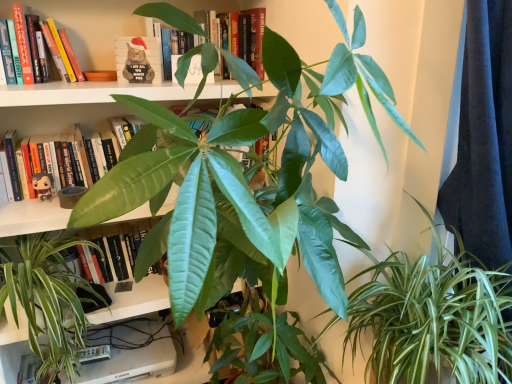
Find the location of `green glossy leafy plant at lower right, the 1th houseplant when ordered from right to left`. green glossy leafy plant at lower right, the 1th houseplant when ordered from right to left is located at coordinates (433, 318).

How much space does green glossy leafy plant at lower right, the 1th houseplant when ordered from right to left, occupy vertically?

The height of green glossy leafy plant at lower right, the 1th houseplant when ordered from right to left, is 20.48 inches.

The width and height of the screenshot is (512, 384). What are the coordinates of `green glossy leafy plant at center, which is counted as the 1th houseplant, starting from the left` in the screenshot? It's located at (47, 300).

Measure the distance between matte black figurine at left, arranged as the first book when ordered from the bottom, and camera.

matte black figurine at left, arranged as the first book when ordered from the bottom, is 1.38 meters from camera.

I want to click on matte black figurine at left, the third book when ordered from top to bottom, so click(34, 126).

What do you see at coordinates (78, 45) in the screenshot? This screenshot has height=384, width=512. I see `hardcover book at upper left, arranged as the 2th book when viewed from the top` at bounding box center [78, 45].

Describe the element at coordinates (172, 17) in the screenshot. This screenshot has width=512, height=384. I see `hardcover book at upper center, which appears as the third book when ordered from the bottom` at that location.

What is the approximate width of green matte leaf at upper center?

It is 2.64 inches.

Image resolution: width=512 pixels, height=384 pixels. I want to click on green glossy leafy plant at center, the second houseplant when ordered from right to left, so click(244, 178).

Locate an element on the screen. This screenshot has width=512, height=384. green glossy leafy plant at lower right, arranged as the 3th houseplant when viewed from the left is located at coordinates (433, 318).

Is green glossy leafy plant at center, the second houseplant in the left-to-right sequence, turned away from santa hat plush at upper center?

green glossy leafy plant at center, the second houseplant in the left-to-right sequence, is not turned away from santa hat plush at upper center.

Would you say green glossy leafy plant at center, the second houseplant in the left-to-right sequence, is inside or outside santa hat plush at upper center?

green glossy leafy plant at center, the second houseplant in the left-to-right sequence, lies outside santa hat plush at upper center.

How far apart are green glossy leafy plant at center, the second houseplant when ordered from right to left, and santa hat plush at upper center?

The distance of green glossy leafy plant at center, the second houseplant when ordered from right to left, from santa hat plush at upper center is 30.81 inches.

Does green glossy leafy plant at center, the second houseplant in the left-to-right sequence, touch santa hat plush at upper center?

No, green glossy leafy plant at center, the second houseplant in the left-to-right sequence, is not touching santa hat plush at upper center.

How different are the orientations of green glossy leafy plant at center, the second houseplant when ordered from right to left, and green glossy leafy plant at lower right, arranged as the 3th houseplant when viewed from the left, in degrees?

There is a 6.05-degree angle between the facing directions of green glossy leafy plant at center, the second houseplant when ordered from right to left, and green glossy leafy plant at lower right, arranged as the 3th houseplant when viewed from the left.

Does green glossy leafy plant at center, the second houseplant when ordered from right to left, have a larger size compared to green glossy leafy plant at lower right, the 1th houseplant when ordered from right to left?

Yes.

In order to click on the 1st houseplant below the green glossy leafy plant at center, the second houseplant in the left-to-right sequence (from a real-world perspective) in this screenshot , I will do `click(433, 318)`.

Is the depth of green glossy leafy plant at center, the second houseplant in the left-to-right sequence, greater than that of green glossy leafy plant at lower right, the 1th houseplant when ordered from right to left?

No, it is not.

Is point (0, 6) more distant than point (119, 205)?

Yes, point (0, 6) is behind point (119, 205).

Between hardcover book at upper left, marked as the 2th book in a bottom-to-top arrangement, and green glossy leafy plant at center, the second houseplant in the left-to-right sequence, which one has larger size?

green glossy leafy plant at center, the second houseplant in the left-to-right sequence.

Is hardcover book at upper left, marked as the 2th book in a bottom-to-top arrangement, not inside green glossy leafy plant at center, the second houseplant in the left-to-right sequence?

That's correct, hardcover book at upper left, marked as the 2th book in a bottom-to-top arrangement, is outside of green glossy leafy plant at center, the second houseplant in the left-to-right sequence.

Based on the photo, considering the relative sizes of green glossy leafy plant at center, the second houseplant when ordered from right to left, and green glossy leafy plant at center, the third houseplant from the right, in the image provided, is green glossy leafy plant at center, the second houseplant when ordered from right to left, bigger than green glossy leafy plant at center, the third houseplant from the right,?

Yes, green glossy leafy plant at center, the second houseplant when ordered from right to left, is bigger than green glossy leafy plant at center, the third houseplant from the right.

Which of these two, green glossy leafy plant at center, the second houseplant when ordered from right to left, or green glossy leafy plant at center, which is counted as the 1th houseplant, starting from the left, stands shorter?

Standing shorter between the two is green glossy leafy plant at center, which is counted as the 1th houseplant, starting from the left.

Would you say green glossy leafy plant at center, the second houseplant when ordered from right to left, is outside green glossy leafy plant at center, the third houseplant from the right?

Indeed, green glossy leafy plant at center, the second houseplant when ordered from right to left, is completely outside green glossy leafy plant at center, the third houseplant from the right.

From the picture: Is matte black figurine at left aimed at green matte leaf at upper center?

No, matte black figurine at left is not oriented towards green matte leaf at upper center.

Who is more distant, matte black figurine at left or green matte leaf at upper center?

green matte leaf at upper center is behind.

Can you confirm if matte black figurine at left is taller than green matte leaf at upper center?

In fact, matte black figurine at left may be shorter than green matte leaf at upper center.

Is point (207, 62) more distant than point (0, 309)?

No, (207, 62) is in front of (0, 309).

Is the position of green matte leaf at upper center less distant than that of green glossy leafy plant at center, the third houseplant from the right?

No, it is behind green glossy leafy plant at center, the third houseplant from the right.

Is green matte leaf at upper center completely or partially outside of green glossy leafy plant at center, the third houseplant from the right?

Yes, green matte leaf at upper center is not within green glossy leafy plant at center, the third houseplant from the right.

Is green matte leaf at upper center wider than green glossy leafy plant at center, which is counted as the 1th houseplant, starting from the left?

In fact, green matte leaf at upper center might be narrower than green glossy leafy plant at center, which is counted as the 1th houseplant, starting from the left.

Considering the positions of point (174, 73) and point (51, 183), is point (174, 73) closer or farther from the camera than point (51, 183)?

Point (174, 73) is closer to the camera than point (51, 183).

Is green matte leaf at upper center next to matte black figurine at left?

There is a gap between green matte leaf at upper center and matte black figurine at left.

From the image's perspective, is green matte leaf at upper center above matte black figurine at left?

Correct, green matte leaf at upper center appears higher than matte black figurine at left in the image.

Considering the relative positions of green matte leaf at upper center and matte black figurine at left in the image provided, is green matte leaf at upper center to the left or to the right of matte black figurine at left?

From the image, it's evident that green matte leaf at upper center is to the right of matte black figurine at left.

From the image's perspective, count 1st houseplants downward from the santa hat plush at upper center and point to it. Please provide its 2D coordinates.

[(244, 178)]

I want to click on houseplant on the right of green glossy leafy plant at center, the second houseplant in the left-to-right sequence, so click(x=433, y=318).

Considering their positions, is santa hat plush at upper center positioned closer to hardcover book at upper center, which appears as the third book when ordered from the bottom, than matte black figurine at left?

The object closer to hardcover book at upper center, which appears as the third book when ordered from the bottom, is santa hat plush at upper center.

Based on their spatial positions, is hardcover book at upper center, which appears as the third book when ordered from the bottom, or green glossy leafy plant at center, the second houseplant in the left-to-right sequence, further from hardcover book at upper left, marked as the 2th book in a bottom-to-top arrangement?

Based on the image, green glossy leafy plant at center, the second houseplant in the left-to-right sequence, appears to be further to hardcover book at upper left, marked as the 2th book in a bottom-to-top arrangement.

Looking at the image, which one is located closer to green glossy leafy plant at center, which is counted as the 1th houseplant, starting from the left, hardcover book at upper center, marked as the 1th book in a top-to-bottom arrangement, or hardcover book at upper left, arranged as the 2th book when viewed from the top?

Based on the image, hardcover book at upper left, arranged as the 2th book when viewed from the top, appears to be nearer to green glossy leafy plant at center, which is counted as the 1th houseplant, starting from the left.

Which object lies further to the anchor point santa hat plush at upper center, green glossy leafy plant at center, the third houseplant from the right, or hardcover book at upper center, marked as the 1th book in a top-to-bottom arrangement?

green glossy leafy plant at center, the third houseplant from the right, is further to santa hat plush at upper center.

Estimate the real-world distances between objects in this image. Which object is closer to green matte leaf at upper center, hardcover book at upper center, marked as the 1th book in a top-to-bottom arrangement, or hardcover book at upper left, arranged as the 2th book when viewed from the top?

hardcover book at upper center, marked as the 1th book in a top-to-bottom arrangement, is positioned closer to the anchor green matte leaf at upper center.

Looking at the image, which one is located further to matte black figurine at left, green glossy leafy plant at center, the second houseplant when ordered from right to left, or santa hat plush at upper center?

green glossy leafy plant at center, the second houseplant when ordered from right to left, is positioned further to the anchor matte black figurine at left.

When comparing their distances from green glossy leafy plant at lower right, arranged as the 3th houseplant when viewed from the left, does hardcover book at upper center, marked as the 1th book in a top-to-bottom arrangement, or green glossy leafy plant at center, the second houseplant when ordered from right to left, seem further?

hardcover book at upper center, marked as the 1th book in a top-to-bottom arrangement, is further to green glossy leafy plant at lower right, arranged as the 3th houseplant when viewed from the left.

Which object lies further to the anchor point santa hat plush at upper center, matte black figurine at left or hardcover book at upper center, marked as the 1th book in a top-to-bottom arrangement?

matte black figurine at left lies further to santa hat plush at upper center than the other object.

The height and width of the screenshot is (384, 512). I want to click on toy positioned between green glossy leafy plant at center, the second houseplant in the left-to-right sequence, and green matte leaf at upper center from near to far, so click(42, 185).

Locate an element on the screen. This screenshot has width=512, height=384. paperback book located between hardcover book at upper left, arranged as the 2th book when viewed from the top, and green glossy leafy plant at lower right, the 1th houseplant when ordered from right to left, in the left-right direction is located at coordinates (138, 60).

You are a GUI agent. You are given a task and a screenshot of the screen. Output one action in this format:
    pyautogui.click(x=<x>, y=<y>)
    Task: Click on the leaf between hardcover book at upper center, which appears as the third book when ordered from the bottom, and matte black figurine at left, the third book when ordered from top to bottom, vertically
    The width and height of the screenshot is (512, 384).
    Given the screenshot: What is the action you would take?
    coord(198,63)

Where is `paperback book that lies between hardcover book at upper center, marked as the 1th book in a top-to-bottom arrangement, and green glossy leafy plant at lower right, arranged as the 3th houseplant when viewed from the left, from top to bottom`? paperback book that lies between hardcover book at upper center, marked as the 1th book in a top-to-bottom arrangement, and green glossy leafy plant at lower right, arranged as the 3th houseplant when viewed from the left, from top to bottom is located at coordinates (138, 60).